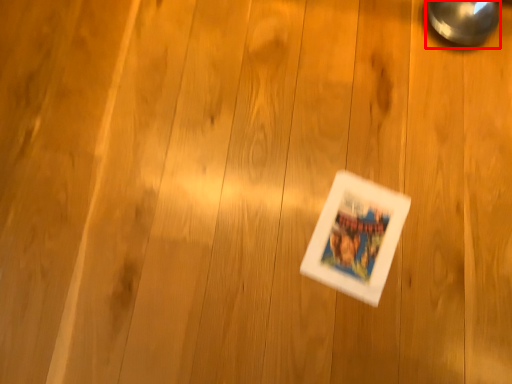
Question: From the image's perspective, what is the correct spatial positioning of magnifying glass (annotated by the red box) in reference to comic book?

Choices:
 (A) below
 (B) above

Answer: (B)